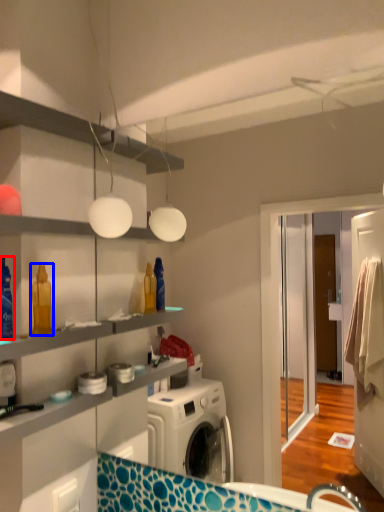
Question: Which object appears closest to the camera in this image, cleaning product (highlighted by a red box) or cleaning product (highlighted by a blue box)?

Choices:
 (A) cleaning product
 (B) cleaning product

Answer: (A)